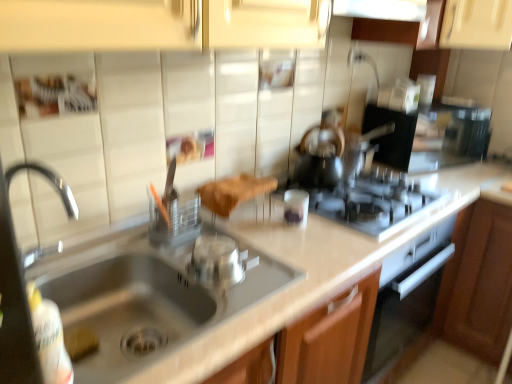
Identify the location of free space in front of silver metallic pot at center, which is the second appliance from right to left. (234, 314).